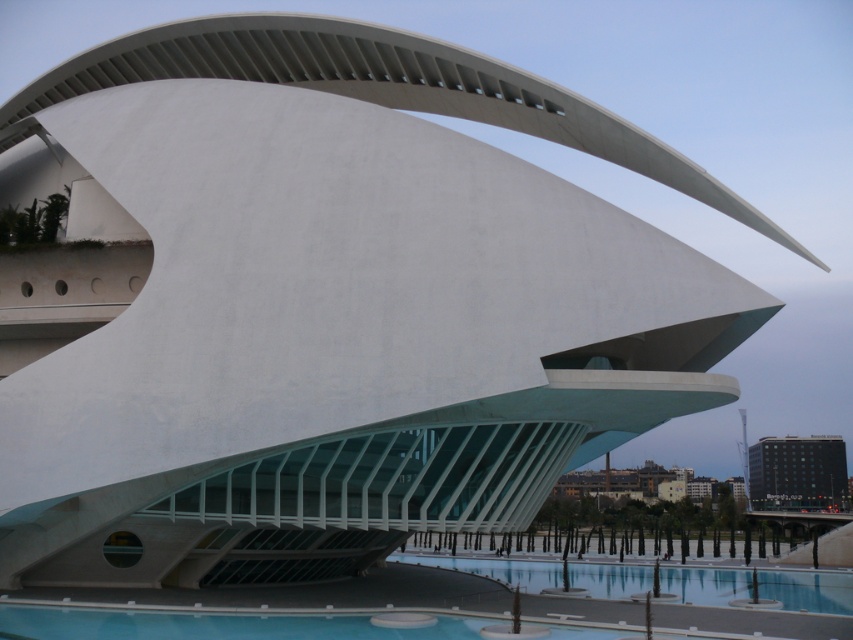
You are an architect designing a new garden layout. You need to place a statue that requires a 3 meter wide space. You see the transparent glass pool at lower center and the black glass building at lower right. Which object can accommodate the statue if the statue needs a 3 meter wide space?

The transparent glass pool at lower center might be wider than black glass building at lower right, so it could potentially accommodate the statue if it requires a 3 meter wide space.

You are standing at the entrance of the futuristic building and want to locate the transparent glass pool at lower center. According to the coordinates provided, where would you find it?

The transparent glass pool at lower center is located at coordinates point (805, 589).